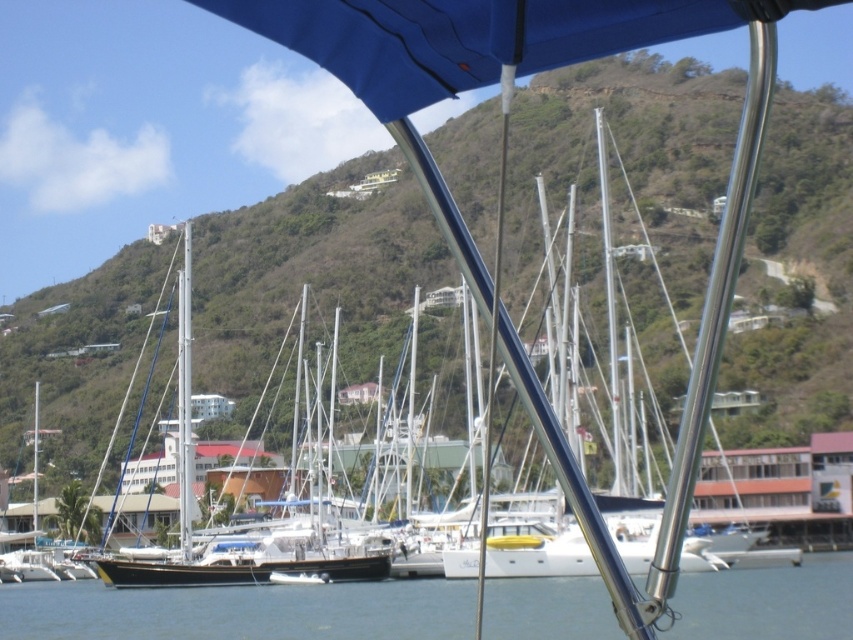
Based on the scene description, can you determine the exact coordinates of the green leafy hillside at center?

The green leafy hillside at center is located at coordinates (310, 273).

You are standing on the deck of a boat and looking out. You see the green leafy hillside at center and the clear blue water at lower center. Which object is closer to you?

The clear blue water at lower center is closer to you because it is positioned under the green leafy hillside at center.

You are a photographer trying to capture the marina scene. You have a camera with a standard lens that can focus on objects up to 5 meters away. The green leafy hillside at center and clear blue water at lower center are both in your view. Which object will appear larger in your photo?

The green leafy hillside at center will appear larger in the photo because it is larger in size than the clear blue water at lower center.